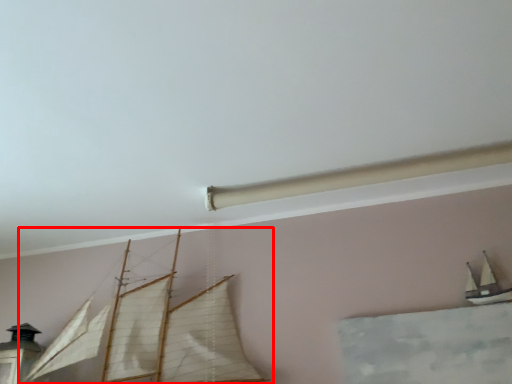
Question: From the image's perspective, what is the correct spatial relationship of boat (annotated by the red box) in relation to boat?

Choices:
 (A) below
 (B) above

Answer: (A)